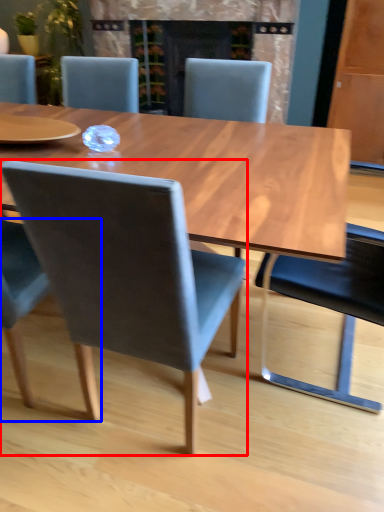
Question: Which point is further to the camera, chair (highlighted by a red box) or chair (highlighted by a blue box)?

Choices:
 (A) chair
 (B) chair

Answer: (B)